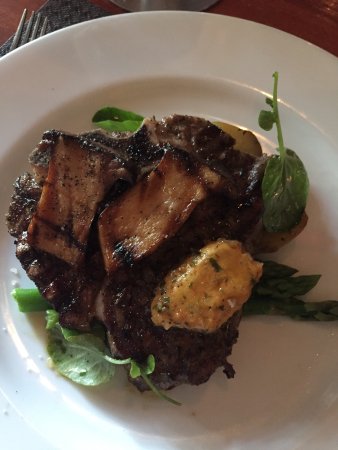
Find the location of a particular element. Image resolution: width=338 pixels, height=450 pixels. table is located at coordinates [282, 10].